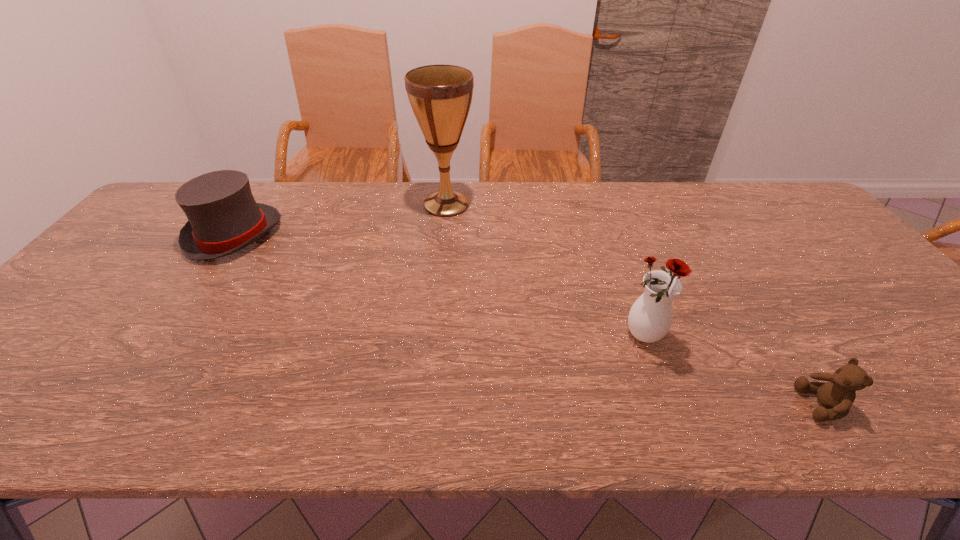
The width and height of the screenshot is (960, 540). I want to click on free spot between the dress hat and the third object from right to left, so click(x=341, y=220).

Image resolution: width=960 pixels, height=540 pixels. What are the coordinates of `free space between the leftmost object and the shortest object` in the screenshot? It's located at (529, 320).

Where is `free space between the second nearest object and the nearest object`? free space between the second nearest object and the nearest object is located at coordinates (734, 370).

The width and height of the screenshot is (960, 540). In order to click on vacant area that lies between the third object from right to left and the third farthest object in this screenshot , I will do `click(546, 271)`.

Identify the location of free point between the third farthest object and the leftmost object. This screenshot has width=960, height=540. (441, 286).

Locate an element on the screen. blank region between the shortest object and the second shortest object is located at coordinates (529, 320).

You are a GUI agent. You are given a task and a screenshot of the screen. Output one action in this format:
    pyautogui.click(x=<x>, y=<y>)
    Task: Click on the free space between the leftmost object and the third object from right to left
    This screenshot has height=540, width=960.
    Given the screenshot: What is the action you would take?
    pyautogui.click(x=341, y=220)

Find the location of `the closest object to the second nearest object`. the closest object to the second nearest object is located at coordinates (836, 396).

Image resolution: width=960 pixels, height=540 pixels. Find the location of `object that is the second nearest to the leftmost object`. object that is the second nearest to the leftmost object is located at coordinates (650, 318).

The width and height of the screenshot is (960, 540). I want to click on free spot that satisfies the following two spatial constraints: 1. on the back side of the third object from right to left; 2. on the right side of the third tallest object, so click(255, 205).